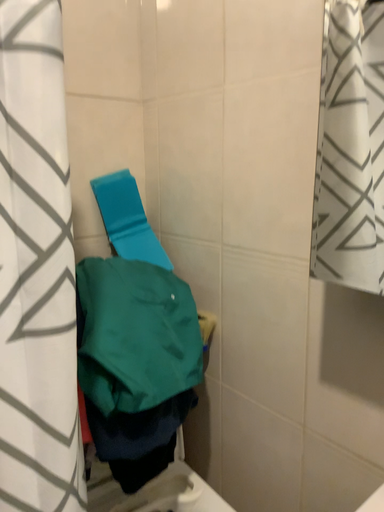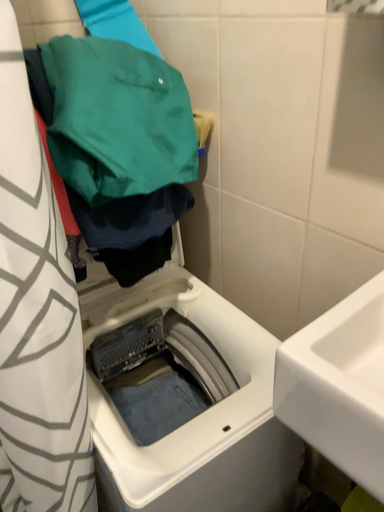
Question: Which way did the camera rotate in the video?

Choices:
 (A) rotated upward
 (B) rotated downward

Answer: (B)